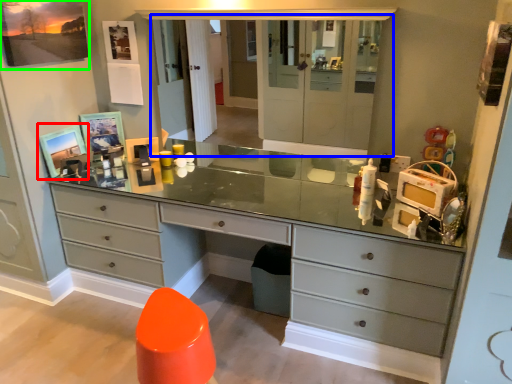
Question: Based on their relative distances, which object is farther from picture frame (highlighted by a red box)? Choose from medicine cabinet (highlighted by a blue box) and picture frame (highlighted by a green box).

Choices:
 (A) medicine cabinet
 (B) picture frame

Answer: (A)